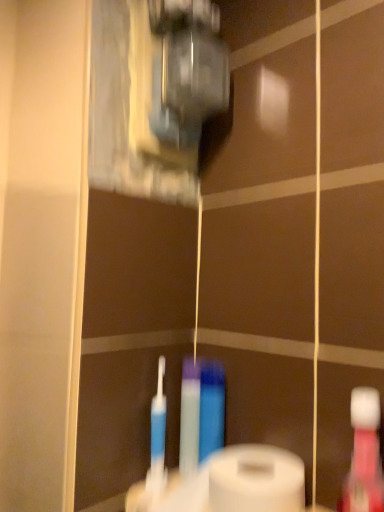
This screenshot has height=512, width=384. I want to click on translucent plastic mouthwash at right, so click(x=364, y=455).

This screenshot has width=384, height=512. What do you see at coordinates (364, 455) in the screenshot?
I see `translucent plastic mouthwash at right` at bounding box center [364, 455].

What is the approximate width of white matte toilet paper at lower center?

white matte toilet paper at lower center is 4.16 inches in width.

What do you see at coordinates (256, 480) in the screenshot? Image resolution: width=384 pixels, height=512 pixels. I see `white matte toilet paper at lower center` at bounding box center [256, 480].

The image size is (384, 512). Find the location of `white matte toilet paper at lower center`. white matte toilet paper at lower center is located at coordinates (256, 480).

Measure the distance between point [295,474] and camera.

Point [295,474] and camera are 28.98 inches apart from each other.

Where is `translucent plastic mouthwash at right`? translucent plastic mouthwash at right is located at coordinates (364, 455).

Between translucent plastic mouthwash at right and white matte toilet paper at lower center, which one appears on the right side from the viewer's perspective?

From the viewer's perspective, translucent plastic mouthwash at right appears more on the right side.

Which is behind, translucent plastic mouthwash at right or white matte toilet paper at lower center?

white matte toilet paper at lower center is further from the camera.

Does point (351, 477) lie in front of point (222, 473)?

Yes, it is in front of point (222, 473).

From the image's perspective, is translucent plastic mouthwash at right located above or below white matte toilet paper at lower center?

translucent plastic mouthwash at right is situated higher than white matte toilet paper at lower center in the image.

From a real-world perspective, between translucent plastic mouthwash at right and white matte toilet paper at lower center, who is vertically higher?

In real-world perspective, translucent plastic mouthwash at right is above.

Considering the sizes of translucent plastic mouthwash at right and white matte toilet paper at lower center in the image, is translucent plastic mouthwash at right wider or thinner than white matte toilet paper at lower center?

In the image, translucent plastic mouthwash at right appears to be more narrow than white matte toilet paper at lower center.

Based on the photo, is translucent plastic mouthwash at right taller or shorter than white matte toilet paper at lower center?

In the image, translucent plastic mouthwash at right appears to be taller than white matte toilet paper at lower center.

Considering the relative sizes of translucent plastic mouthwash at right and white matte toilet paper at lower center in the image provided, is translucent plastic mouthwash at right smaller than white matte toilet paper at lower center?

Yes.

Is translucent plastic mouthwash at right located outside white matte toilet paper at lower center?

Yes.

Are translucent plastic mouthwash at right and white matte toilet paper at lower center located far from each other?

No, translucent plastic mouthwash at right is in close proximity to white matte toilet paper at lower center.

Is translucent plastic mouthwash at right looking in the opposite direction of white matte toilet paper at lower center?

That's not correct — translucent plastic mouthwash at right is not looking away from white matte toilet paper at lower center.

How many degrees apart are the facing directions of translucent plastic mouthwash at right and white matte toilet paper at lower center?

They differ by 0.00352 degrees in their facing directions.

Find the location of a particular element. mouthwash positioned vertically above the white matte toilet paper at lower center (from a real-world perspective) is located at coordinates (364, 455).

Between white matte toilet paper at lower center and translucent plastic mouthwash at right, which one appears on the right side from the viewer's perspective?

From the viewer's perspective, translucent plastic mouthwash at right appears more on the right side.

Which object is further away from the camera, white matte toilet paper at lower center or translucent plastic mouthwash at right?

white matte toilet paper at lower center is further from the camera.

Does point (265, 476) come in front of point (376, 391)?

No.

From the image's perspective, is white matte toilet paper at lower center positioned above or below translucent plastic mouthwash at right?

From the image's perspective, white matte toilet paper at lower center appears below translucent plastic mouthwash at right.

From a real-world perspective, is white matte toilet paper at lower center positioned under translucent plastic mouthwash at right based on gravity?

Yes, from a real-world perspective, white matte toilet paper at lower center is beneath translucent plastic mouthwash at right.

Between white matte toilet paper at lower center and translucent plastic mouthwash at right, which one has larger width?

white matte toilet paper at lower center.

Does white matte toilet paper at lower center have a lesser height compared to translucent plastic mouthwash at right?

Yes.

Who is bigger, white matte toilet paper at lower center or translucent plastic mouthwash at right?

Answer: white matte toilet paper at lower center is bigger.

Would you say white matte toilet paper at lower center is outside translucent plastic mouthwash at right?

Indeed, white matte toilet paper at lower center is completely outside translucent plastic mouthwash at right.

Based on the photo, is white matte toilet paper at lower center not close to translucent plastic mouthwash at right?

They are positioned close to each other.

Is white matte toilet paper at lower center oriented towards translucent plastic mouthwash at right?

No, white matte toilet paper at lower center is not turned towards translucent plastic mouthwash at right.

Locate an element on the screen. Image resolution: width=384 pixels, height=512 pixels. toilet paper below the translucent plastic mouthwash at right (from the image's perspective) is located at coordinates (256, 480).

Locate an element on the screen. This screenshot has height=512, width=384. toilet paper on the left of translucent plastic mouthwash at right is located at coordinates (256, 480).

Where is `mouthwash lying in front of the white matte toilet paper at lower center`? mouthwash lying in front of the white matte toilet paper at lower center is located at coordinates tap(364, 455).